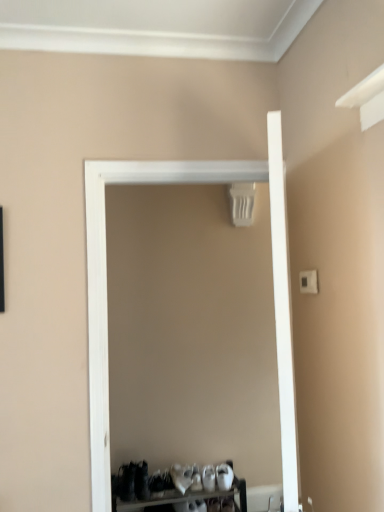
Question: Is white matte door at center turned away from white plastic shoe rack at lower center?

Choices:
 (A) yes
 (B) no

Answer: (A)

Question: Is white matte door at center next to white plastic shoe rack at lower center?

Choices:
 (A) no
 (B) yes

Answer: (A)

Question: Can white plastic shoe rack at lower center be found inside white matte door at center?

Choices:
 (A) no
 (B) yes

Answer: (A)

Question: From the image's perspective, is white matte door at center on white plastic shoe rack at lower center?

Choices:
 (A) no
 (B) yes

Answer: (B)

Question: Considering the relative sizes of white matte door at center and white plastic shoe rack at lower center in the image provided, is white matte door at center wider than white plastic shoe rack at lower center?

Choices:
 (A) no
 (B) yes

Answer: (A)

Question: Does white matte door at center appear on the right side of white plastic shoe rack at lower center?

Choices:
 (A) yes
 (B) no

Answer: (A)

Question: Is white plastic shoe rack at lower center far from white matte door at center?

Choices:
 (A) yes
 (B) no

Answer: (A)

Question: Does white plastic shoe rack at lower center have a lesser height compared to white matte door at center?

Choices:
 (A) no
 (B) yes

Answer: (B)

Question: Is white plastic shoe rack at lower center directly adjacent to white matte door at center?

Choices:
 (A) no
 (B) yes

Answer: (A)

Question: Can you confirm if white plastic shoe rack at lower center is smaller than white matte door at center?

Choices:
 (A) yes
 (B) no

Answer: (A)

Question: From the image's perspective, does white plastic shoe rack at lower center appear higher than white matte door at center?

Choices:
 (A) yes
 (B) no

Answer: (B)

Question: From a real-world perspective, is white plastic shoe rack at lower center located beneath white matte door at center?

Choices:
 (A) no
 (B) yes

Answer: (B)

Question: Looking at the image, does white plastic shoe rack at lower center seem bigger or smaller compared to white matte door at center?

Choices:
 (A) small
 (B) big

Answer: (A)